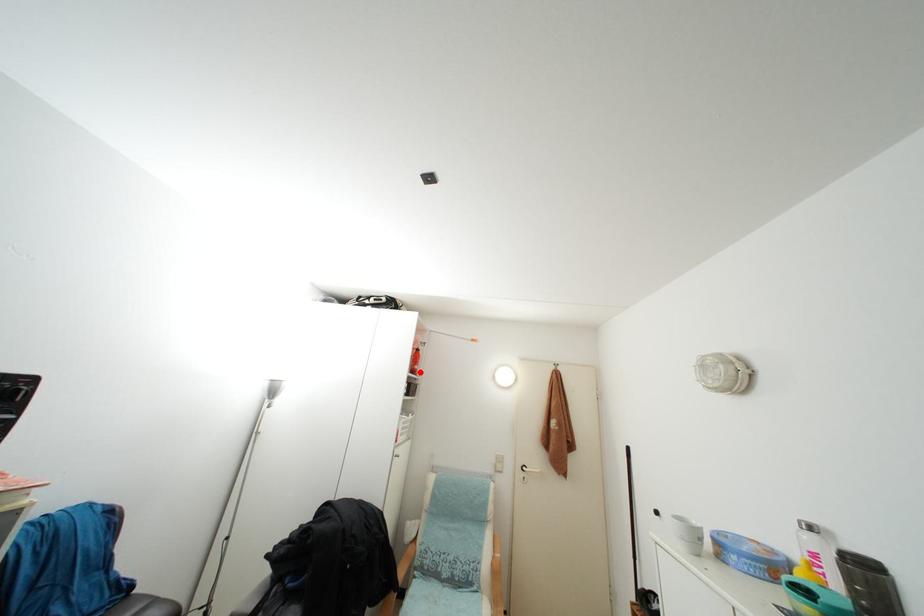
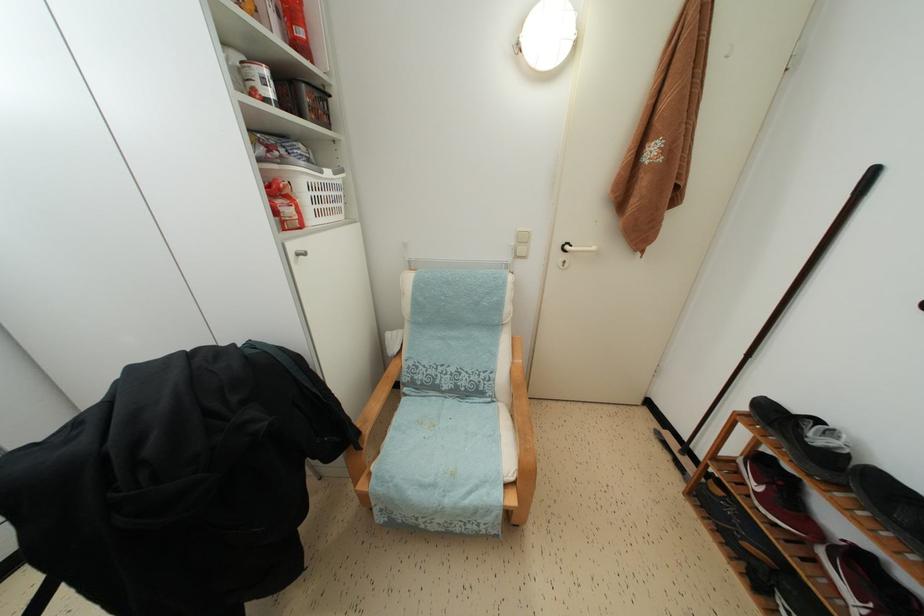
Where in the second image is the point corresponding to the highlighted location from the first image?

(305, 38)